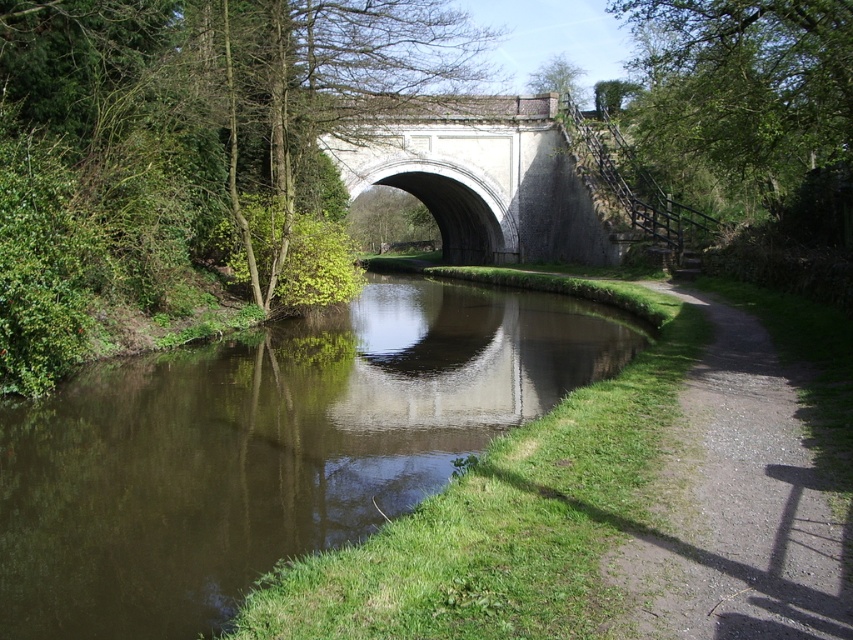
Question: Is gravel path at lower right smaller than white stone bridge at center?

Choices:
 (A) no
 (B) yes

Answer: (B)

Question: Observing the image, what is the correct spatial positioning of green leafy tree at center in reference to green leafy tree at upper center?

Choices:
 (A) right
 (B) left

Answer: (B)

Question: Is brown reflective water at center below white stone bridge at center?

Choices:
 (A) yes
 (B) no

Answer: (A)

Question: Which point is closer to the camera?

Choices:
 (A) (572, 77)
 (B) (677, 577)
 (C) (381, 291)
 (D) (555, 244)

Answer: (B)

Question: Among these objects, which one is farthest from the camera?

Choices:
 (A) gravel path at lower right
 (B) brown reflective water at center
 (C) green leafy tree at upper center
 (D) green leafy tree at upper right

Answer: (C)

Question: Which object is positioned closest to the brown reflective water at center?

Choices:
 (A) white stone bridge at center
 (B) green leafy tree at upper center

Answer: (A)